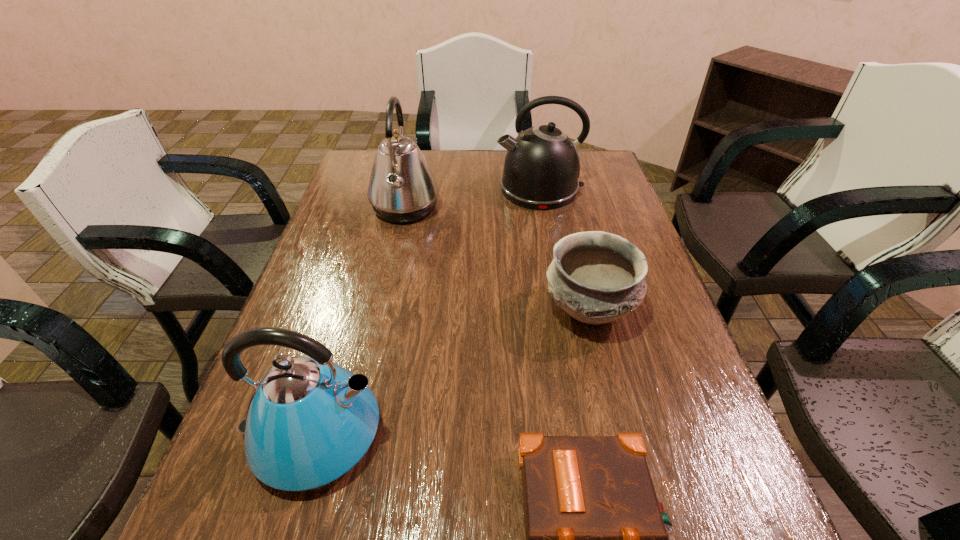
Identify which object is located as the second nearest to the third nearest object. Please provide its 2D coordinates. Your answer should be formatted as a tuple, i.e. [(x, y)], where the tuple contains the x and y coordinates of a point satisfying the conditions above.

[(542, 166)]

Locate an element on the screen. This screenshot has width=960, height=540. kettle that is the third closest to the shortest object is located at coordinates (542, 166).

At what (x,y) coordinates should I click in order to perform the action: click on kettle that is the closest to the rightmost kettle. Please return your answer as a coordinate pair (x, y). Looking at the image, I should click on (402, 188).

Where is `vacant area in the image that satisfies the following two spatial constraints: 1. on the spout of the rightmost kettle; 2. on the right side of the pottery`? The width and height of the screenshot is (960, 540). vacant area in the image that satisfies the following two spatial constraints: 1. on the spout of the rightmost kettle; 2. on the right side of the pottery is located at coordinates (562, 310).